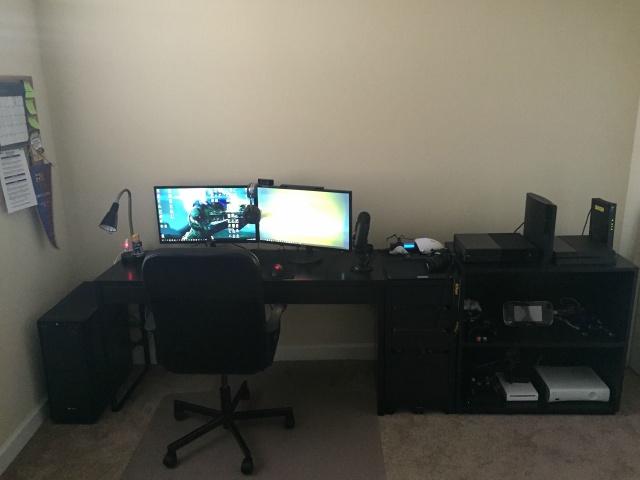
This screenshot has width=640, height=480. I want to click on chair legs, so click(240, 443), click(185, 444), click(188, 411), click(241, 396), click(260, 416).